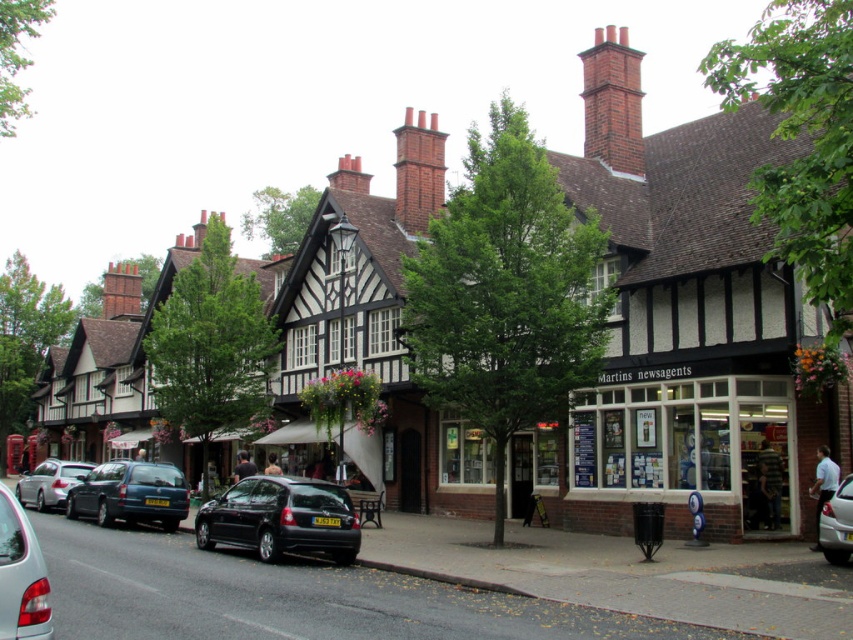
Question: Does metallic blue car at center-left have a smaller size compared to metallic blue sedan at center?

Choices:
 (A) yes
 (B) no

Answer: (B)

Question: Is white glass storefront at center closer to the viewer compared to metallic blue sedan at center?

Choices:
 (A) no
 (B) yes

Answer: (A)

Question: Which object is the closest to the metallic blue car at center-left?

Choices:
 (A) metallic silver car at lower left
 (B) metallic blue sedan at center
 (C) shiny black hatchback at center
 (D) matte black car at lower left

Answer: (C)

Question: Among these objects, which one is nearest to the camera?

Choices:
 (A) metallic silver car at lower left
 (B) metallic blue sedan at center
 (C) white glass storefront at center
 (D) matte black car at lower left

Answer: (D)

Question: Is white glass storefront at center smaller than matte black car at lower left?

Choices:
 (A) no
 (B) yes

Answer: (A)

Question: Which of the following is the farthest from the observer?

Choices:
 (A) metallic blue car at center-left
 (B) metallic blue sedan at center
 (C) white glass storefront at center
 (D) metallic silver car at lower left

Answer: (D)